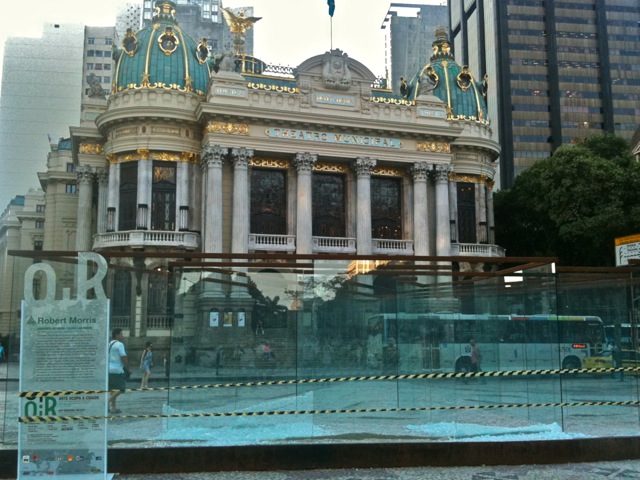
Where is `2nd floor window`? This screenshot has height=480, width=640. 2nd floor window is located at coordinates (329, 201).